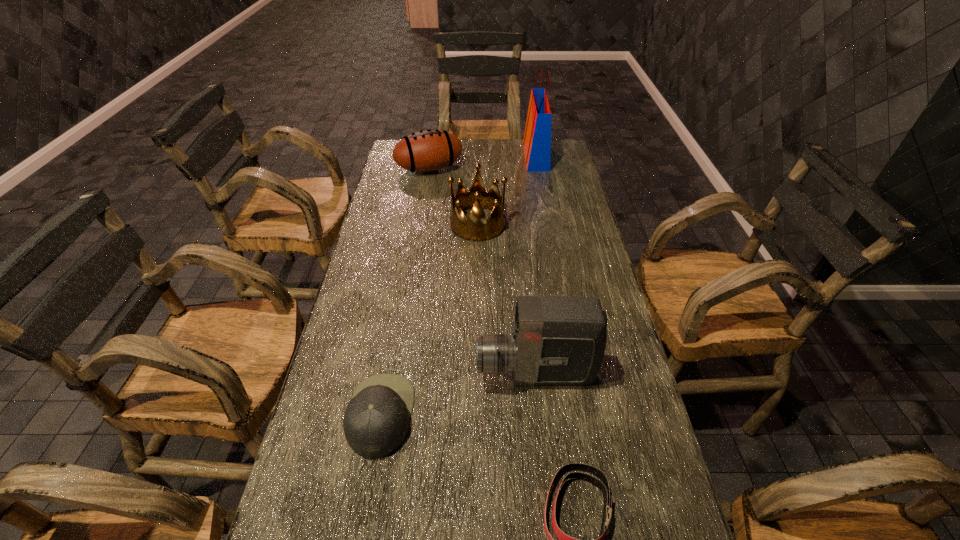
The width and height of the screenshot is (960, 540). Identify the location of the tallest object. (537, 138).

This screenshot has width=960, height=540. I want to click on the fifth shortest object, so click(556, 340).

Image resolution: width=960 pixels, height=540 pixels. I want to click on the third farthest object, so click(x=477, y=227).

Where is `the fourth shortest object`? The image size is (960, 540). the fourth shortest object is located at coordinates (477, 227).

What are the coordinates of `the third shortest object` in the screenshot? It's located at (431, 150).

You are a GUI agent. You are given a task and a screenshot of the screen. Output one action in this format:
    pyautogui.click(x=<x>, y=<y>)
    Task: Click on the cap
    Image resolution: width=960 pixels, height=540 pixels.
    Given the screenshot: What is the action you would take?
    pyautogui.click(x=376, y=421)

The height and width of the screenshot is (540, 960). Find the location of `free space located 0.050m on the handle side of the tallest object`. free space located 0.050m on the handle side of the tallest object is located at coordinates (x=513, y=157).

The image size is (960, 540). Identify the location of vacant space located on the handle side of the tallest object. (503, 157).

The width and height of the screenshot is (960, 540). Identify the location of vacant space located on the handle side of the tallest object. (466, 157).

You are a GUI agent. You are given a task and a screenshot of the screen. Output one action in this format:
    pyautogui.click(x=<x>, y=<y>)
    Task: Click on the vacant region located at the front of the fifth shortest object, highlighting the lens
    The image size is (960, 540).
    Given the screenshot: What is the action you would take?
    pyautogui.click(x=445, y=375)